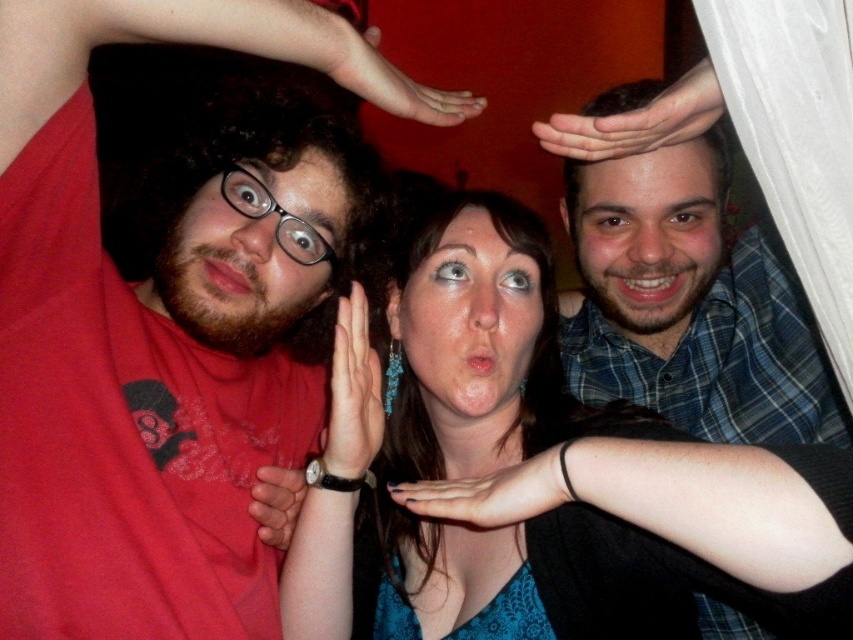
Based on the scene description, where is the matte red shirt at left located in the image? Please provide the coordinates in the format of point followed by the coordinate numbers.

The matte red shirt at left is located at point (146, 344).

You are standing in the room where the three people are posing. You notice the matte red shirt at left and the woman in the center. Based on their positions, which object is closer to the camera?

The matte red shirt at left is located at point (x=146, y=344), which is closer to the camera than the woman in the center.